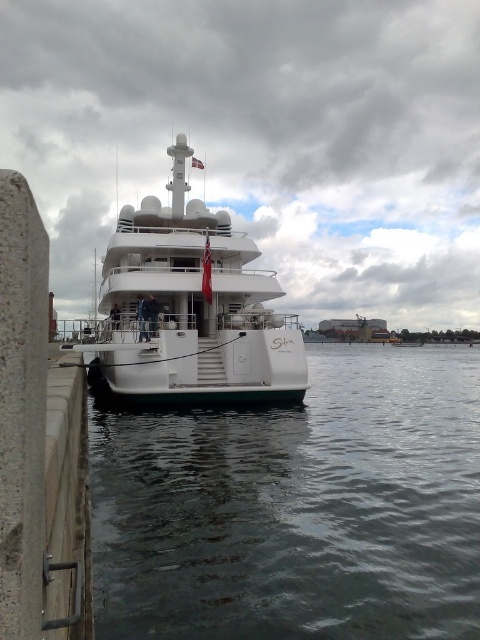
You are a photographer planning to take a photo of the white glossy yacht at center from the pier. Considering the clear water at lower center, will the yacht appear taller than the water in the photo?

The clear water at lower center is not as tall as white glossy yacht at center, so in the photo, the yacht will appear taller than the water.

You are standing on the pier and looking at the clear water at lower center and the white glossy yacht at center. Which object is closer to the bottom edge of the image?

The clear water at lower center is closer to the bottom edge of the image because it is located below the white glossy yacht at center.